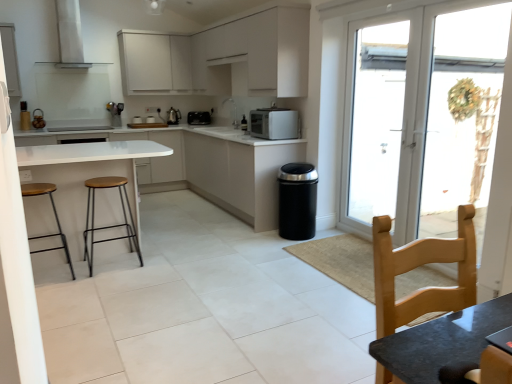
This screenshot has height=384, width=512. What are the coordinates of `light wood chair at lower right` in the screenshot? It's located at click(x=418, y=266).

What do you see at coordinates (137, 120) in the screenshot? The image size is (512, 384). I see `metallic silver toaster at center` at bounding box center [137, 120].

The height and width of the screenshot is (384, 512). Describe the element at coordinates (173, 116) in the screenshot. I see `metallic silver coffee machine at center` at that location.

Image resolution: width=512 pixels, height=384 pixels. In order to click on light wood chair at lower right in this screenshot , I will do `click(418, 266)`.

Considering the sizes of transparent glass door at right and light wood chair at lower right in the image, is transparent glass door at right bigger or smaller than light wood chair at lower right?

In the image, transparent glass door at right appears to be larger than light wood chair at lower right.

Relative to light wood chair at lower right, is transparent glass door at right in front or behind?

Clearly, transparent glass door at right is behind light wood chair at lower right.

Which of these two, transparent glass door at right or light wood chair at lower right, stands shorter?

Standing shorter between the two is light wood chair at lower right.

Can you tell me how much transparent glass door at right and light wood chair at lower right differ in facing direction?

The angular difference between transparent glass door at right and light wood chair at lower right is 86.6 degrees.

Considering the sizes of white glossy sink at center and metallic silver coffee machine at center in the image, is white glossy sink at center taller or shorter than metallic silver coffee machine at center?

white glossy sink at center is shorter than metallic silver coffee machine at center.

Is white glossy sink at center positioned in front of metallic silver coffee machine at center?

Yes.

Is white glossy sink at center thinner than metallic silver coffee machine at center?

No, white glossy sink at center is not thinner than metallic silver coffee machine at center.

Consider the image. Does white glossy sink at center have a smaller size compared to metallic silver coffee machine at center?

Incorrect, white glossy sink at center is not smaller in size than metallic silver coffee machine at center.

From the image's perspective, count 1st cabinetrys downward from the transparent glass door at right and point to it. Please provide its 2D coordinates.

[(240, 174)]

Is transparent glass door at right inside the boundaries of white matte cabinet at center, which is the third cabinetry from top to bottom, or outside?

transparent glass door at right is not inside white matte cabinet at center, which is the third cabinetry from top to bottom, it's outside.

Is transparent glass door at right at the left side of white matte cabinet at center, which is the third cabinetry from top to bottom?

In fact, transparent glass door at right is to the right of white matte cabinet at center, which is the third cabinetry from top to bottom.

Measure the distance from transparent glass door at right to white matte cabinet at center, marked as the 2th cabinetry in a bottom-to-top arrangement.

transparent glass door at right is 1.38 meters away from white matte cabinet at center, marked as the 2th cabinetry in a bottom-to-top arrangement.

Is white matte cabinet at upper center, placed as the 3th cabinetry when sorted from bottom to top, facing away from light wood chair at lower right?

No.

Can you confirm if white matte cabinet at upper center, placed as the 3th cabinetry when sorted from bottom to top, is wider than light wood chair at lower right?

Yes, white matte cabinet at upper center, placed as the 3th cabinetry when sorted from bottom to top, is wider than light wood chair at lower right.

Is white matte cabinet at upper center, placed as the 3th cabinetry when sorted from bottom to top, located outside light wood chair at lower right?

Yes, white matte cabinet at upper center, placed as the 3th cabinetry when sorted from bottom to top, is located beyond the bounds of light wood chair at lower right.

Does white matte cabinet at upper center, the 2th cabinetry viewed from the top, appear on the left side of light wood chair at lower right?

Correct, you'll find white matte cabinet at upper center, the 2th cabinetry viewed from the top, to the left of light wood chair at lower right.

Which object is positioned more to the left, white plastic screen door at right or satin silver microwave at center, the 1th kitchen appliance when ordered from right to left?

From the viewer's perspective, satin silver microwave at center, the 1th kitchen appliance when ordered from right to left, appears more on the left side.

Is white plastic screen door at right looking in the opposite direction of satin silver microwave at center, which is the second kitchen appliance from top to bottom?

white plastic screen door at right does not have its back to satin silver microwave at center, which is the second kitchen appliance from top to bottom.

How much distance is there between white plastic screen door at right and satin silver microwave at center, arranged as the second kitchen appliance when viewed from the left?

white plastic screen door at right is 1.11 meters from satin silver microwave at center, arranged as the second kitchen appliance when viewed from the left.

From a real-world perspective, is white plastic screen door at right physically above satin silver microwave at center, which is the second kitchen appliance from top to bottom?

Actually, white plastic screen door at right is physically below satin silver microwave at center, which is the second kitchen appliance from top to bottom, in the real world.

Does white matte cabinetry at center, the fourth cabinetry positioned from the top, contain satin silver microwave at center, the second kitchen appliance viewed from the back?

Yes, satin silver microwave at center, the second kitchen appliance viewed from the back, can be found within white matte cabinetry at center, the fourth cabinetry positioned from the top.

Considering the relative sizes of white matte cabinetry at center, the fourth cabinetry positioned from the top, and satin silver microwave at center, the 1th kitchen appliance viewed from the front, in the image provided, is white matte cabinetry at center, the fourth cabinetry positioned from the top, taller than satin silver microwave at center, the 1th kitchen appliance viewed from the front,?

Yes.

Consider the image. Between white matte cabinetry at center, the first cabinetry from the bottom, and satin silver microwave at center, the second kitchen appliance viewed from the back, which one appears on the left side from the viewer's perspective?

white matte cabinetry at center, the first cabinetry from the bottom.

Measure the distance from white matte cabinetry at center, the fourth cabinetry positioned from the top, to satin silver microwave at center, which is the second kitchen appliance from top to bottom.

white matte cabinetry at center, the fourth cabinetry positioned from the top, is 27.38 inches from satin silver microwave at center, which is the second kitchen appliance from top to bottom.

Consider the image. From a real-world perspective, between metallic silver coffee machine at center and white glossy table at center, who is vertically higher?

From a 3D spatial view, metallic silver coffee machine at center is above.

Considering the relative sizes of metallic silver coffee machine at center and white glossy table at center in the image provided, is metallic silver coffee machine at center taller than white glossy table at center?

No.

From the image's perspective, between metallic silver coffee machine at center and white glossy table at center, which one is located above?

From the image's view, metallic silver coffee machine at center is above.

Locate an element on the screen. chair on the left of transparent glass door at right is located at coordinates (418, 266).

Where is `coffee machine located above the white glossy sink at center (from a real-world perspective)`? This screenshot has width=512, height=384. coffee machine located above the white glossy sink at center (from a real-world perspective) is located at coordinates (173, 116).

Looking at this image, which object lies further to the anchor point white matte cabinet at upper center, acting as the 1th cabinetry starting from the top, light wood chair at lower right or satin silver microwave at center, arranged as the second kitchen appliance when viewed from the left?

Based on the image, light wood chair at lower right appears to be further to white matte cabinet at upper center, acting as the 1th cabinetry starting from the top.

Estimate the real-world distances between objects in this image. Which object is closer to white matte cabinet at upper center, the fourth cabinetry in the bottom-to-top sequence, wooden seat and metal frame stool at left, positioned as the 2th stool in left-to-right order, or metallic silver coffee machine at center?

metallic silver coffee machine at center is positioned closer to the anchor white matte cabinet at upper center, the fourth cabinetry in the bottom-to-top sequence.

When comparing their distances from transparent glass door at right, does white matte cabinet at upper center, placed as the 3th cabinetry when sorted from bottom to top, or satin black toaster at center, the second kitchen appliance viewed from the right, seem closer?

The object closer to transparent glass door at right is white matte cabinet at upper center, placed as the 3th cabinetry when sorted from bottom to top.

From the image, which object appears to be nearer to white glossy sink at center, metallic silver toaster at center or satin black toaster at center, acting as the first kitchen appliance starting from the back?

Among the two, satin black toaster at center, acting as the first kitchen appliance starting from the back, is located nearer to white glossy sink at center.

Which object lies nearer to the anchor point satin black toaster at center, acting as the first kitchen appliance starting from the back, white plastic screen door at right or metallic silver toaster at center?

metallic silver toaster at center is closer to satin black toaster at center, acting as the first kitchen appliance starting from the back.

Estimate the real-world distances between objects in this image. Which object is further from white plastic screen door at right, metallic silver coffee machine at center or white glossy stove at center?

white glossy stove at center.

Based on their spatial positions, is satin silver microwave at center, the 1th kitchen appliance when ordered from right to left, or white glossy stove at center further from metallic silver coffee machine at center?

The object further to metallic silver coffee machine at center is satin silver microwave at center, the 1th kitchen appliance when ordered from right to left.

From the image, which object appears to be nearer to metallic silver coffee machine at center, light wood chair at lower right or white matte cabinet at center, marked as the 2th cabinetry in a bottom-to-top arrangement?

Among the two, white matte cabinet at center, marked as the 2th cabinetry in a bottom-to-top arrangement, is located nearer to metallic silver coffee machine at center.

Locate an element on the screen. Image resolution: width=512 pixels, height=384 pixels. kitchen appliance between wooden seat and metal frame stool at left, which is counted as the 1th stool, starting from the right, and white matte cabinet at upper center, acting as the 1th cabinetry starting from the top, from front to back is located at coordinates (274, 123).

Where is `sink situated between white glossy stove at center and transparent glass door at right from left to right`? The width and height of the screenshot is (512, 384). sink situated between white glossy stove at center and transparent glass door at right from left to right is located at coordinates (222, 133).

Where is `stool situated between white matte cabinet at upper center, acting as the 1th cabinetry starting from the top, and transparent glass door at right from left to right`? The height and width of the screenshot is (384, 512). stool situated between white matte cabinet at upper center, acting as the 1th cabinetry starting from the top, and transparent glass door at right from left to right is located at coordinates (109, 225).

You are a GUI agent. You are given a task and a screenshot of the screen. Output one action in this format:
    pyautogui.click(x=<x>, y=<y>)
    Task: Click on the stove positioned between white matte cabinetry at center, the first cabinetry from the bottom, and white matte cabinet at upper center, acting as the 1th cabinetry starting from the top, from near to far
    This screenshot has height=384, width=512.
    Given the screenshot: What is the action you would take?
    pyautogui.click(x=79, y=128)